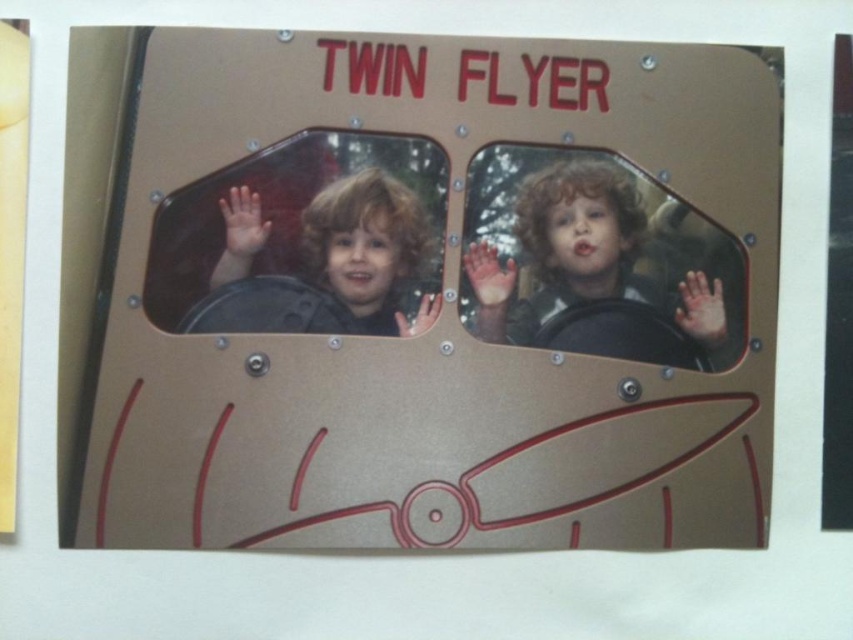
Question: Is metallic gold sign at center smaller than matte black helmet at left?

Choices:
 (A) yes
 (B) no

Answer: (B)

Question: Is metallic gold sign at center to the left of matte black steering wheel at center from the viewer's perspective?

Choices:
 (A) no
 (B) yes

Answer: (B)

Question: Which point is closer to the camera?

Choices:
 (A) metallic gold sign at center
 (B) matte black helmet at left
 (C) matte black steering wheel at center

Answer: (A)

Question: Is metallic gold sign at center below matte black helmet at left?

Choices:
 (A) no
 (B) yes

Answer: (B)

Question: Which object is positioned farthest from the matte black steering wheel at center?

Choices:
 (A) matte black helmet at left
 (B) metallic gold sign at center

Answer: (A)

Question: Considering the real-world distances, which object is farthest from the matte black helmet at left?

Choices:
 (A) metallic gold sign at center
 (B) matte black steering wheel at center

Answer: (B)